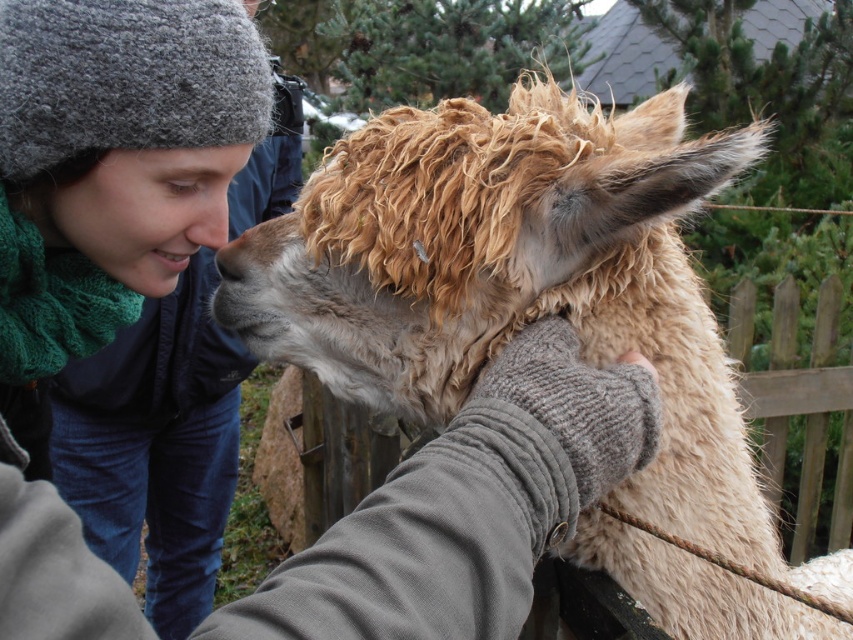
Question: Which point appears farthest from the camera in this image?

Choices:
 (A) (x=196, y=234)
 (B) (x=397, y=212)
 (C) (x=242, y=248)

Answer: (C)

Question: Among these points, which one is nearest to the camera?

Choices:
 (A) (677, 144)
 (B) (223, 205)

Answer: (B)

Question: Is fuzzy beige alpaca at center positioned before brown woolen nose at center?

Choices:
 (A) yes
 (B) no

Answer: (A)

Question: Can you confirm if matte skin nose at center is thinner than brown woolen nose at center?

Choices:
 (A) no
 (B) yes

Answer: (A)

Question: Which of the following is the farthest from the observer?

Choices:
 (A) matte skin nose at center
 (B) fuzzy beige alpaca at center
 (C) brown woolen nose at center

Answer: (C)

Question: Does fuzzy beige alpaca at center appear under brown woolen nose at center?

Choices:
 (A) yes
 (B) no

Answer: (A)